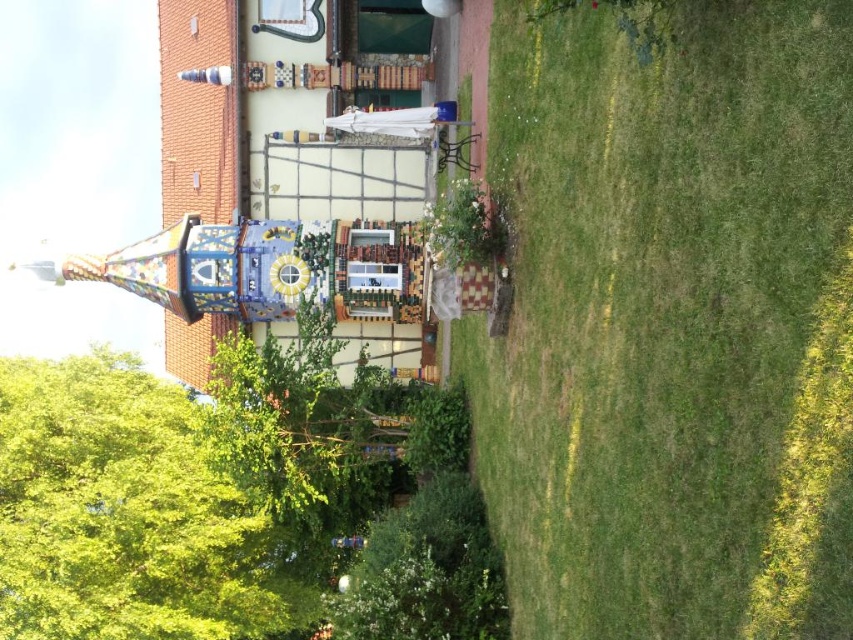
Is point (552, 525) positioned behind point (165, 516)?

No, (552, 525) is in front of (165, 516).

Where is `green grass at lower right`? The height and width of the screenshot is (640, 853). green grass at lower right is located at coordinates (670, 321).

The height and width of the screenshot is (640, 853). Find the location of `green grass at lower right`. green grass at lower right is located at coordinates (670, 321).